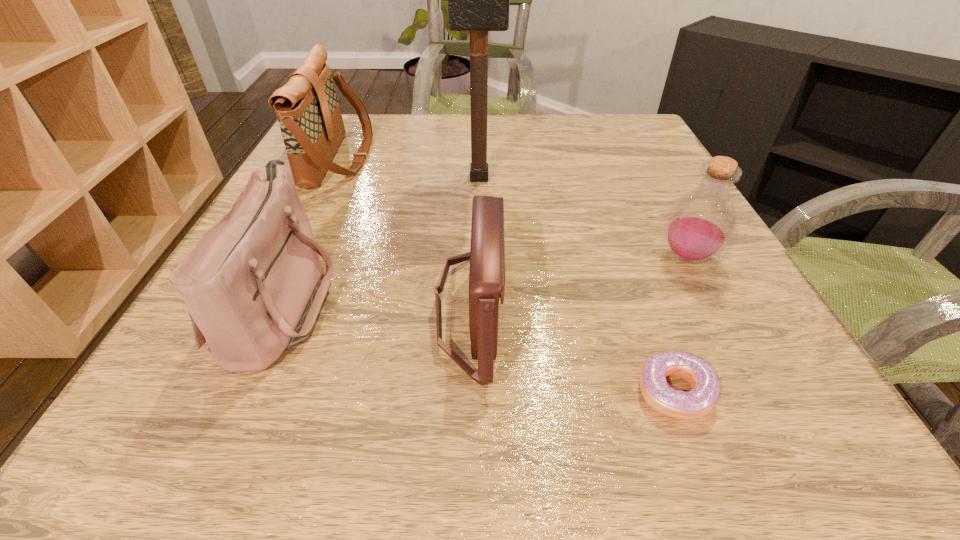
The width and height of the screenshot is (960, 540). Find the location of `vacant region located on the front of the rightmost object`. vacant region located on the front of the rightmost object is located at coordinates (759, 395).

This screenshot has width=960, height=540. In order to click on free space located on the front pocket of the second tallest shoulder bag in this screenshot , I will do `click(408, 302)`.

Find the location of a particular element. This screenshot has width=960, height=540. free region located on the front flap of the rightmost shoulder bag is located at coordinates (609, 309).

The height and width of the screenshot is (540, 960). What are the coordinates of `vacant region located on the left of the doughnut` in the screenshot? It's located at (560, 392).

At what (x,y) coordinates should I click in order to perform the action: click on object at the far edge. Please return your answer as a coordinate pair (x, y). This screenshot has height=540, width=960. Looking at the image, I should click on pyautogui.click(x=307, y=108).

You are a GUI agent. You are given a task and a screenshot of the screen. Output one action in this format:
    pyautogui.click(x=<x>, y=<y>)
    Task: Click on the shoulder bag that is at the near edge
    
    Given the screenshot: What is the action you would take?
    pyautogui.click(x=487, y=251)

Where is `doughnut at the near edge`? doughnut at the near edge is located at coordinates (698, 402).

Where is `bottle positioned at the right edge`? The height and width of the screenshot is (540, 960). bottle positioned at the right edge is located at coordinates (701, 223).

Locate an element on the screen. This screenshot has height=540, width=960. doughnut that is at the right edge is located at coordinates (698, 402).

This screenshot has height=540, width=960. In order to click on object at the far left corner in this screenshot , I will do `click(307, 108)`.